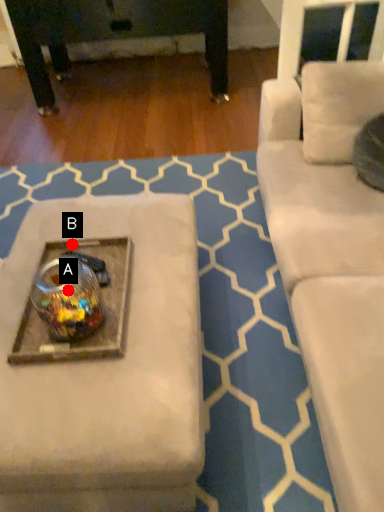
Question: Two points are circled on the image, labeled by A and B beside each circle. Which point appears farthest from the camera in this image?

Choices:
 (A) A is further
 (B) B is further

Answer: (B)